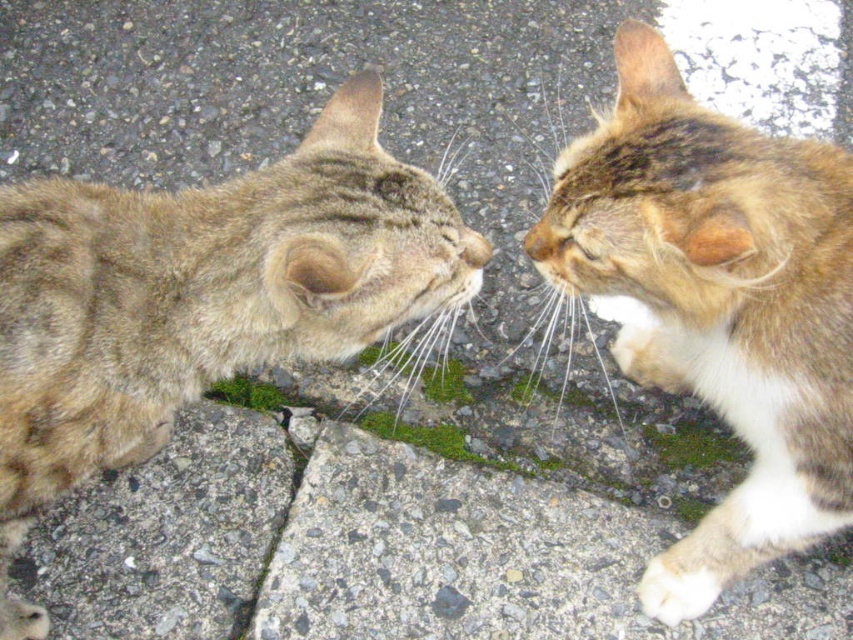
You are a photographer trying to capture a closeup shot of the tabby fur cat at right and the matte fur nose at center. Which object should you focus on first if you want to ensure both are in focus without adjusting the camera settings?

The tabby fur cat at right is wider than the matte fur nose at center, so focusing on the wider object first will help ensure both are in focus.

You are observing two points in the image of the cats. Which point, point [55,385] or point [537,250], is closer to you?

Point [55,385] is closer to the viewer than point [537,250].

You are a photographer trying to capture a closeup shot of the tabby fur cat at center and the matte fur nose at center. Which object should you focus on first to ensure both are in sharp focus?

The tabby fur cat at center is positioned under matte fur nose at center, so you should focus on the matte fur nose at center first to ensure both are in sharp focus.